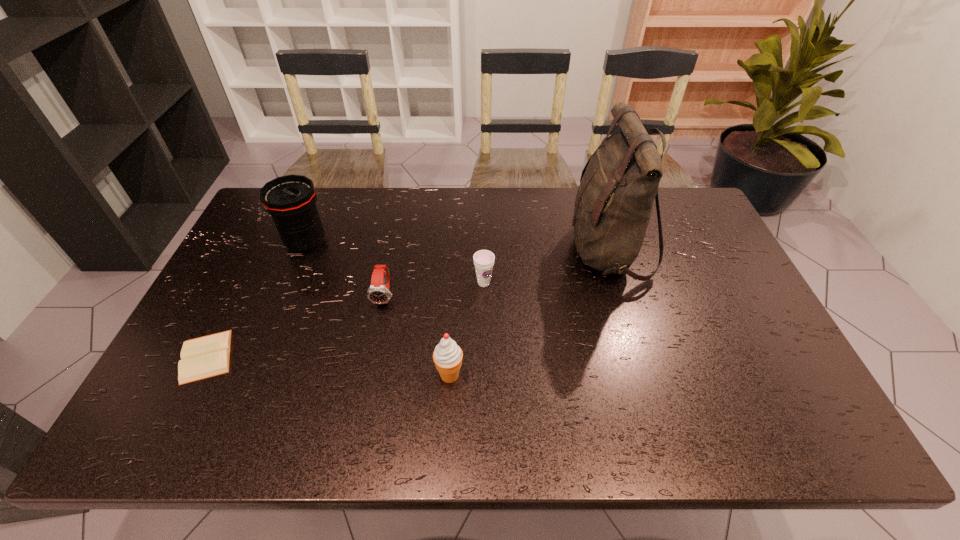
Locate an element on the screen. the rightmost object is located at coordinates (614, 201).

Find the location of a particular element. backpack is located at coordinates (614, 201).

Locate an element on the screen. The width and height of the screenshot is (960, 540). telephoto lens is located at coordinates (291, 200).

Locate an element on the screen. Image resolution: width=960 pixels, height=540 pixels. icecream is located at coordinates (447, 356).

The height and width of the screenshot is (540, 960). I want to click on the fourth shortest object, so click(x=447, y=356).

Locate an element on the screen. This screenshot has width=960, height=540. the fifth object from left to right is located at coordinates (483, 260).

In order to click on watch in this screenshot , I will do `click(378, 293)`.

Identify the location of diary. (208, 356).

Where is `free space located 0.140m on the open flap of the tallest object`? free space located 0.140m on the open flap of the tallest object is located at coordinates (523, 250).

Find the location of `vacant space situated 0.380m on the open flap of the tallest object`. vacant space situated 0.380m on the open flap of the tallest object is located at coordinates (447, 250).